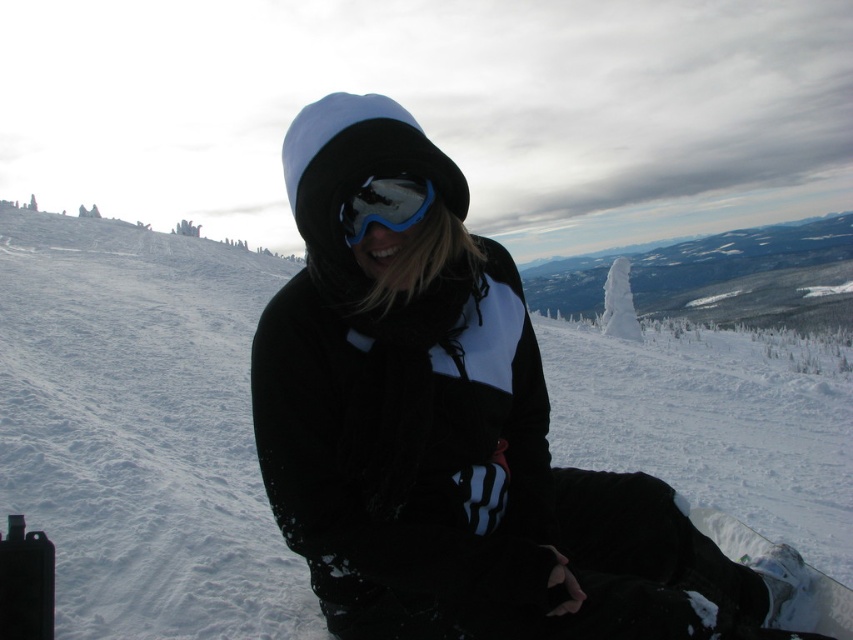
Question: Among these objects, which one is farthest from the camera?

Choices:
 (A) matte blue ski goggles at center
 (B) white fluffy snow at center
 (C) white glossy snowboard at lower right

Answer: (B)

Question: Is white glossy snowboard at lower right closer to camera compared to matte blue ski goggles at center?

Choices:
 (A) yes
 (B) no

Answer: (B)

Question: Can you confirm if white glossy snowboard at lower right is thinner than matte blue ski goggles at center?

Choices:
 (A) no
 (B) yes

Answer: (A)

Question: Estimate the real-world distances between objects in this image. Which object is farther from the matte blue ski goggles at center?

Choices:
 (A) white fluffy snow at center
 (B) white glossy snowboard at lower right

Answer: (A)

Question: Which object is closer to the camera taking this photo?

Choices:
 (A) matte blue ski goggles at center
 (B) white glossy snowboard at lower right
 (C) white fluffy snow at center

Answer: (A)

Question: Does white glossy snowboard at lower right have a lesser width compared to matte blue ski goggles at center?

Choices:
 (A) yes
 (B) no

Answer: (B)